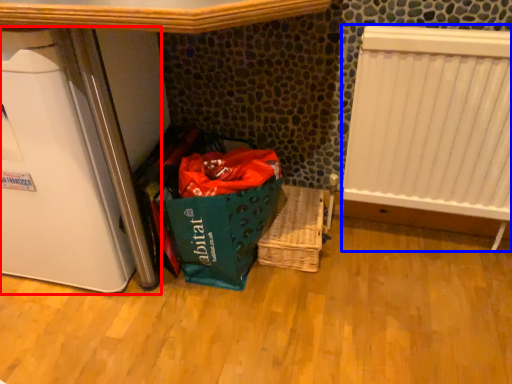
Question: Which of the following is the closest to the observer, appliance (highlighted by a red box) or radiator (highlighted by a blue box)?

Choices:
 (A) appliance
 (B) radiator

Answer: (A)